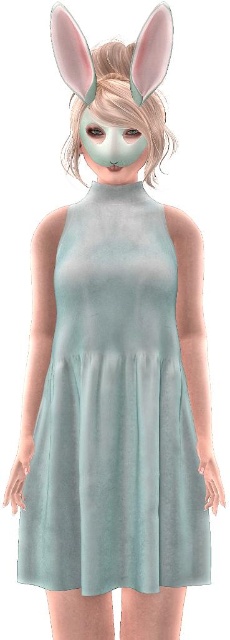
Consider the image. Which is more to the left, mint fabric dress at center or matte white mask at center?

matte white mask at center

Is mint fabric dress at center bigger than matte white mask at center?

Yes.

Find the location of a particular element. mint fabric dress at center is located at coordinates (115, 413).